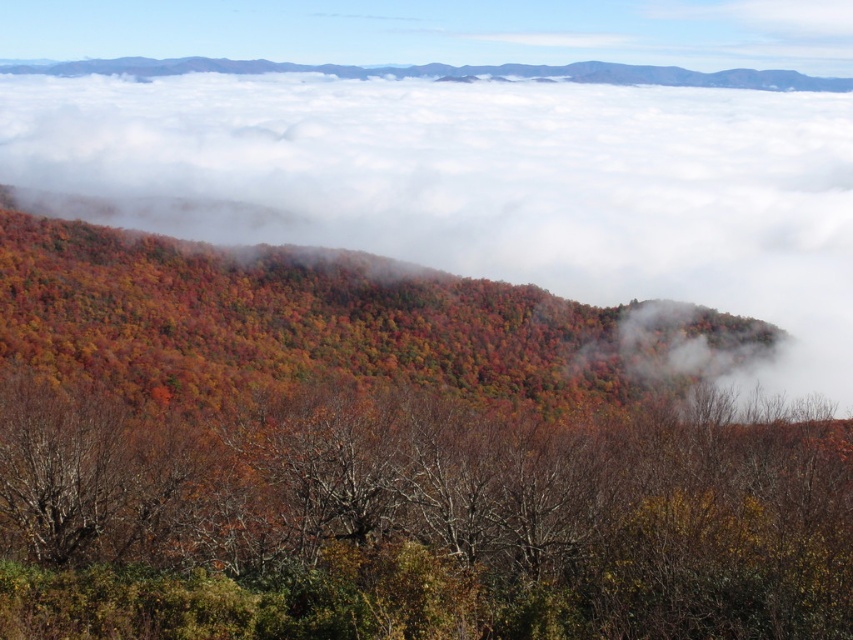
Question: Does brown matte tree at center appear under white fluffy cloud at upper center?

Choices:
 (A) yes
 (B) no

Answer: (A)

Question: Can you confirm if brown matte tree at center is positioned to the right of white fluffy cloud at upper center?

Choices:
 (A) no
 (B) yes

Answer: (A)

Question: Where is brown matte tree at center located in relation to white fluffy cloud at upper center in the image?

Choices:
 (A) left
 (B) right

Answer: (A)